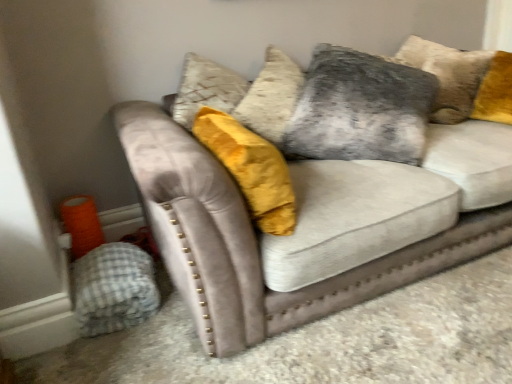
Question: Is velvet gray couch at center to the right of gray checkered blanket at lower left from the viewer's perspective?

Choices:
 (A) yes
 (B) no

Answer: (A)

Question: Does velvet gray couch at center have a smaller size compared to gray checkered blanket at lower left?

Choices:
 (A) yes
 (B) no

Answer: (B)

Question: Is gray checkered blanket at lower left completely or partially inside velvet gray couch at center?

Choices:
 (A) yes
 (B) no

Answer: (B)

Question: Would you consider velvet gray couch at center to be distant from gray checkered blanket at lower left?

Choices:
 (A) yes
 (B) no

Answer: (B)

Question: Is velvet gray couch at center facing towards gray checkered blanket at lower left?

Choices:
 (A) yes
 (B) no

Answer: (B)

Question: In terms of size, does gray checkered blanket at lower left appear bigger or smaller than velvet gray pillow at upper center?

Choices:
 (A) big
 (B) small

Answer: (B)

Question: Is point (77, 296) closer or farther from the camera than point (330, 140)?

Choices:
 (A) closer
 (B) farther

Answer: (A)

Question: Is gray checkered blanket at lower left wider or thinner than velvet gray pillow at upper center?

Choices:
 (A) wide
 (B) thin

Answer: (B)

Question: From a real-world perspective, is gray checkered blanket at lower left physically located above or below velvet gray pillow at upper center?

Choices:
 (A) above
 (B) below

Answer: (B)

Question: Is velvet gray couch at center wider or thinner than gray checkered blanket at lower left?

Choices:
 (A) wide
 (B) thin

Answer: (A)

Question: In terms of height, does velvet gray couch at center look taller or shorter compared to gray checkered blanket at lower left?

Choices:
 (A) tall
 (B) short

Answer: (A)

Question: Do you think velvet gray couch at center is within gray checkered blanket at lower left, or outside of it?

Choices:
 (A) outside
 (B) inside

Answer: (A)

Question: Based on their sizes in the image, would you say velvet gray couch at center is bigger or smaller than gray checkered blanket at lower left?

Choices:
 (A) big
 (B) small

Answer: (A)

Question: Would you say velvet gray pillow at upper center is to the left or to the right of gray checkered blanket at lower left in the picture?

Choices:
 (A) right
 (B) left

Answer: (A)

Question: From a real-world perspective, relative to gray checkered blanket at lower left, is velvet gray pillow at upper center vertically above or below?

Choices:
 (A) above
 (B) below

Answer: (A)